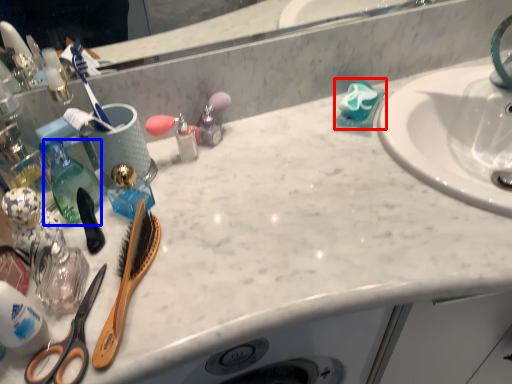
Question: Which of the following is the closest to the observer, cleaning product (highlighted by a red box) or bottle (highlighted by a blue box)?

Choices:
 (A) cleaning product
 (B) bottle

Answer: (B)